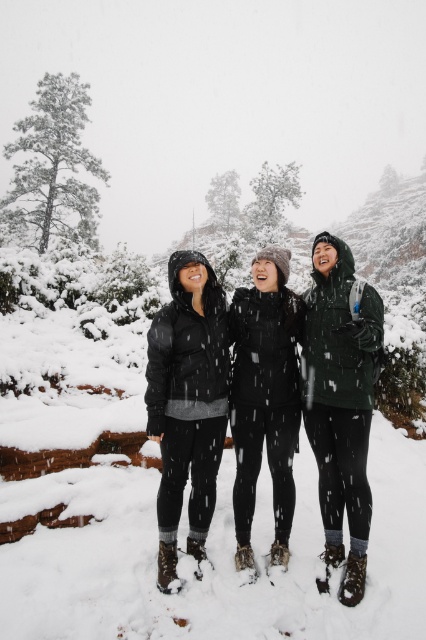
You are standing in the snowy landscape and want to know how far the point marked as point (175, 362) is from you. Can you determine the distance?

The point marked as point (175, 362) is 3.90 meters away from the camera, so it is 3.90 meters away from you.

You are trying to decide which jacket to wear for a snowstorm. You need a jacket that can cover your entire body. Based on the image, which one between the matte black jacket at center and the black fleece jacket at center would you choose?

The black fleece jacket at center occupies more space than the matte black jacket at center, so it would be better to choose the black fleece jacket at center as it can cover your entire body better.

You are trying to identify the person wearing the matte black jacket at center. Based on the snowy scene described, which of the following statements is true about their position relative to the black fleece jacket at center?

The matte black jacket at center is in front of the black fleece jacket at center.